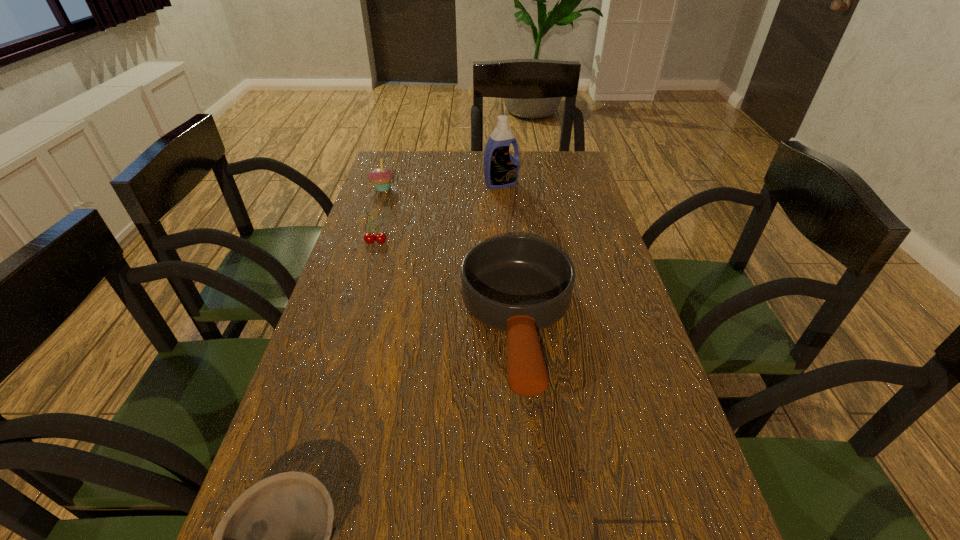
Image resolution: width=960 pixels, height=540 pixels. I want to click on cupcake that is positioned at the left edge, so click(x=381, y=177).

Identify the location of cherry present at the left edge. (369, 238).

This screenshot has height=540, width=960. What are the coordinates of `object present at the right edge` in the screenshot? It's located at (518, 284).

Image resolution: width=960 pixels, height=540 pixels. I want to click on object that is at the far left corner, so click(381, 177).

Identify the location of vacant space at the far edge. This screenshot has width=960, height=540. (519, 151).

In the image, there is a desktop. Where is `vacant space at the left edge`? This screenshot has width=960, height=540. vacant space at the left edge is located at coordinates (392, 231).

Find the location of a particular element. The image size is (960, 540). vacant space at the right edge is located at coordinates (619, 295).

Image resolution: width=960 pixels, height=540 pixels. I want to click on vacant area that lies between the second tallest object and the detergent, so click(x=442, y=186).

At what (x,y) coordinates should I click in order to perform the action: click on empty location between the detergent and the cherry. Please return your answer as a coordinate pair (x, y). The width and height of the screenshot is (960, 540). Looking at the image, I should click on (439, 213).

Locate which object ranks second in proximity to the fourth farthest object. Please provide its 2D coordinates. Your answer should be formatted as a tuple, i.e. [(x, y)], where the tuple contains the x and y coordinates of a point satisfying the conditions above.

[(369, 238)]